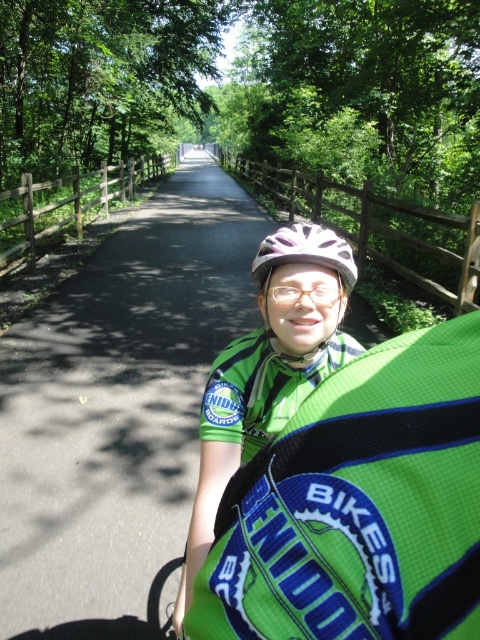
You are a cyclist wearing the green mesh vest at center and want to check if your vest is visible to others on the black asphalt path at center. Based on their positions, can you see your vest from the path?

The black asphalt path at center is above green mesh vest at center, so the vest is positioned below the path. Since the path is elevated, others on the path would have a clear view downward to see the green mesh vest at center.

You are a cyclist on the black asphalt path at center. You want to check your white matte bicycle helmet at center without moving from your current position. Is the helmet currently visible to you?

The white matte bicycle helmet at center is behind the black asphalt path at center, so it is not visible to you from your current position on the path.